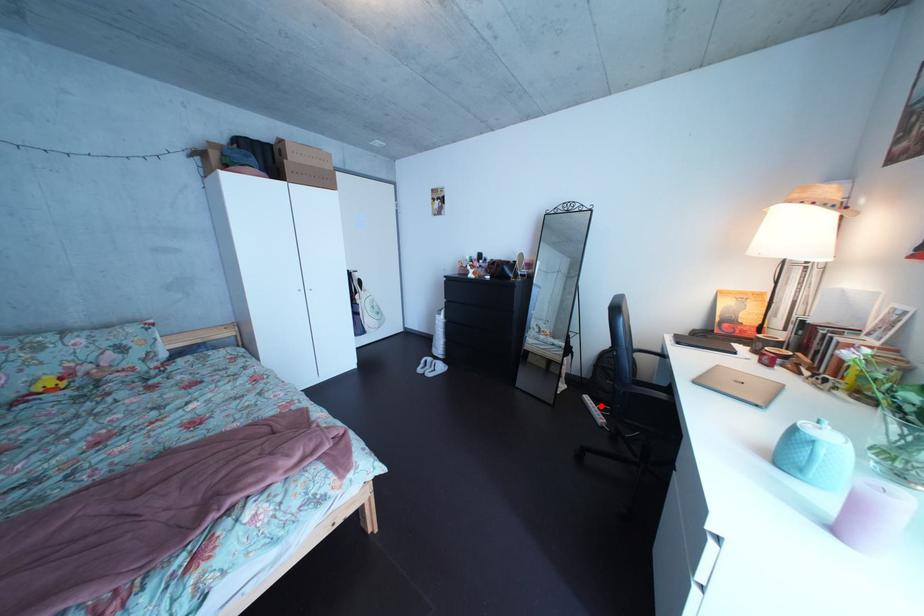
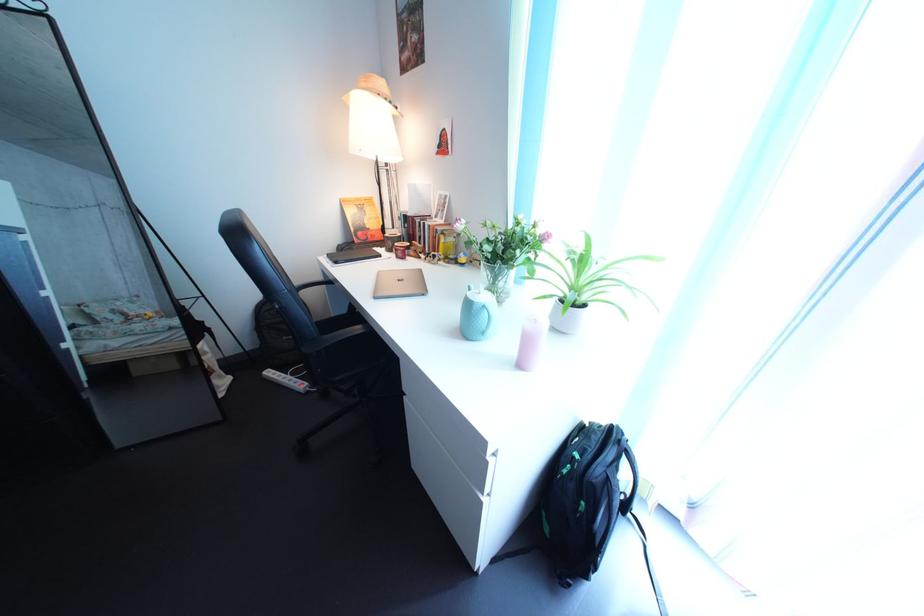
Question: I am providing you with two images of the same scene from different viewpoints. A red point is marked on the first image. Can you still see the location of the red point in image 2?

Choices:
 (A) Yes
 (B) No

Answer: (A)